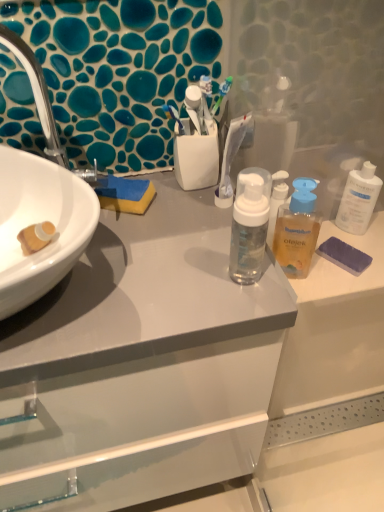
Question: From a real-world perspective, is white glossy cabinet at center physically located above or below purple sponge at right?

Choices:
 (A) above
 (B) below

Answer: (B)

Question: Is point (168, 417) positioned closer to the camera than point (352, 246)?

Choices:
 (A) closer
 (B) farther

Answer: (A)

Question: Which object is positioned closest to the white glossy cabinet at center?

Choices:
 (A) purple sponge at right
 (B) white plastic bottle at upper right
 (C) matte white sink at left
 (D) translucent plastic bottle at center

Answer: (C)

Question: Considering the real-world distances, which object is closest to the translucent plastic bottle at center?

Choices:
 (A) matte white sink at left
 (B) white glossy cabinet at center
 (C) white plastic bottle at upper right
 (D) purple sponge at right

Answer: (D)